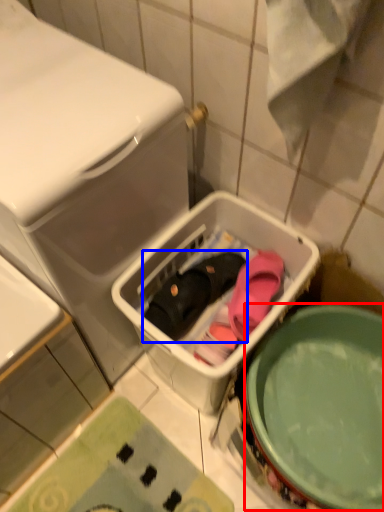
Question: Among these objects, which one is farthest to the camera, mixing bowl (highlighted by a red box) or footwear (highlighted by a blue box)?

Choices:
 (A) mixing bowl
 (B) footwear

Answer: (B)